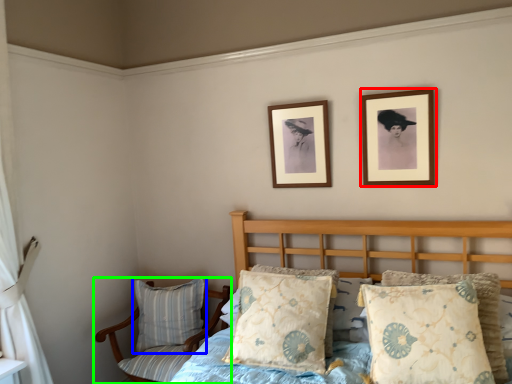
Question: Which is farther away from picture frame (highlighted by a red box)? pillow (highlighted by a blue box) or chair (highlighted by a green box)?

Choices:
 (A) pillow
 (B) chair

Answer: (A)